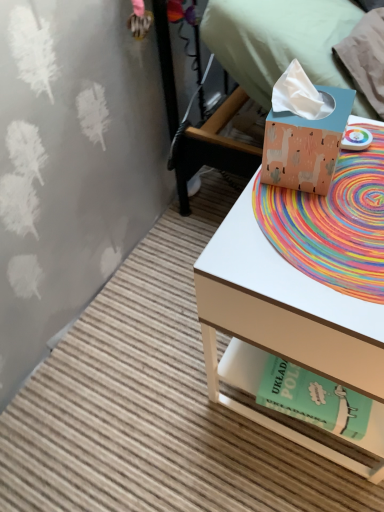
In order to click on blank space situated above matte cardboard tissue box at right (from a real-world perspective) in this screenshot , I will do `click(322, 216)`.